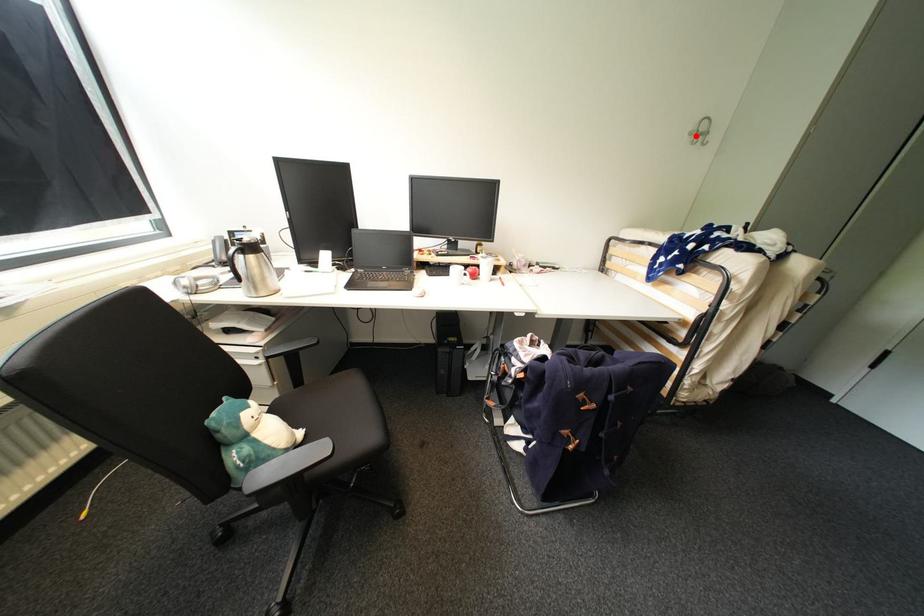
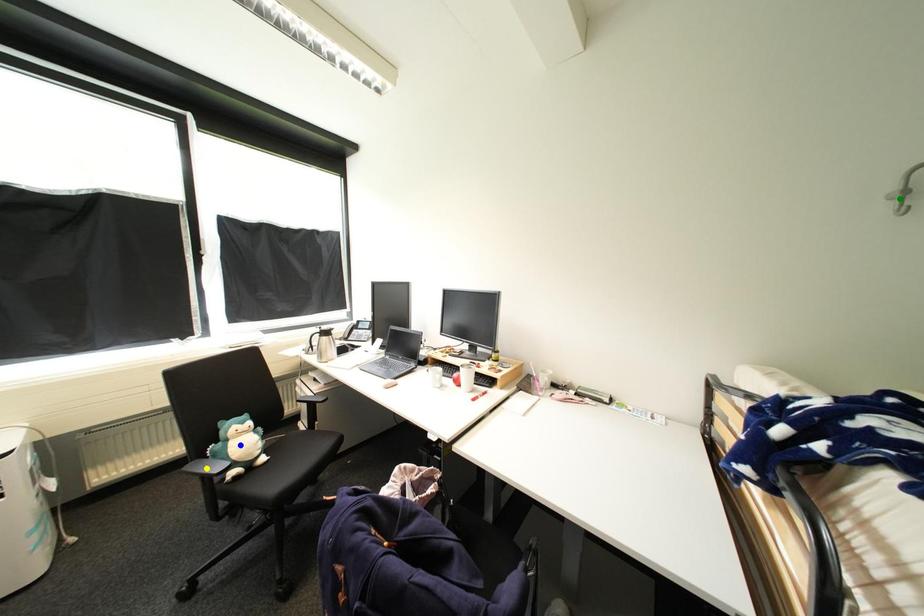
Question: I am providing you with two images of the same scene from different viewpoints. A red point is marked on the first image. You are given multiple points on the second image. Which mark in image 2 goes with the point in image 1?

Choices:
 (A) blue point
 (B) yellow point
 (C) green point

Answer: (C)